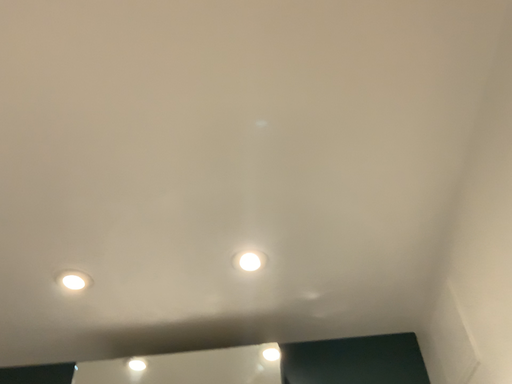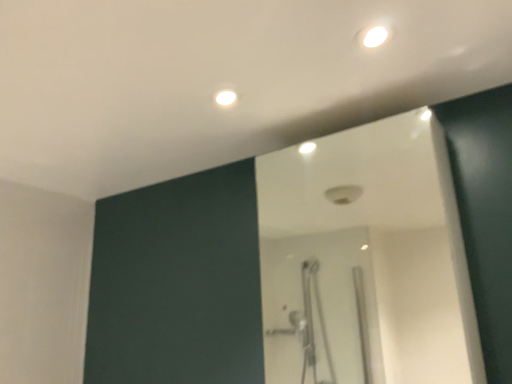
Question: How did the camera likely rotate when shooting the video?

Choices:
 (A) rotated right
 (B) rotated left

Answer: (B)